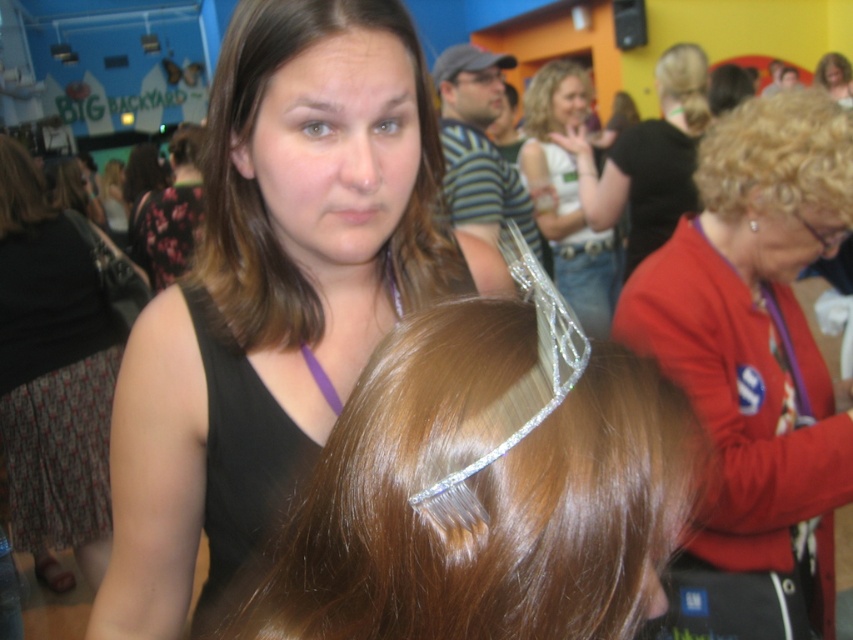
Question: Which object is positioned closest to the clear crystal tiara at center?

Choices:
 (A) blonde curly hair at upper right
 (B) blonde hair at upper center

Answer: (A)

Question: Is matte black hair clip at upper center positioned at the back of floral fabric dress at upper left?

Choices:
 (A) yes
 (B) no

Answer: (B)

Question: Estimate the real-world distances between objects in this image. Which object is farther from the clear crystal tiara at center?

Choices:
 (A) black fabric dress at left
 (B) blonde hair at upper center
 (C) matte red sweater at upper right
 (D) brownsmoothhair at center

Answer: (B)

Question: Does black fabric dress at left come in front of clear plastic tiara at upper center?

Choices:
 (A) yes
 (B) no

Answer: (A)

Question: Among these objects, which one is nearest to the camera?

Choices:
 (A) blonde curly hair at upper right
 (B) blonde hair at upper center
 (C) shiny silver tiara at upper center
 (D) matte black cap at upper center

Answer: (A)

Question: Does brownsmoothhair at center have a larger size compared to shiny silver tiara at upper center?

Choices:
 (A) no
 (B) yes

Answer: (A)